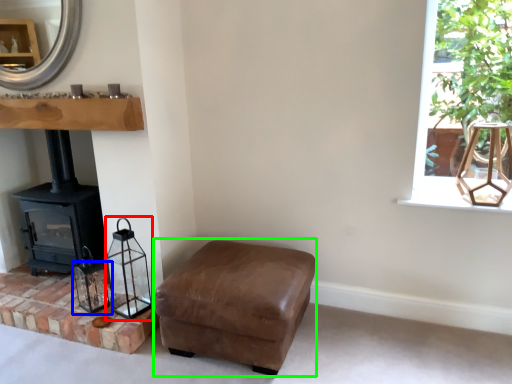
Question: Which object is positioned farthest from lamp (highlighted by a red box)? Select from candle holder (highlighted by a blue box) and armchair (highlighted by a green box).

Choices:
 (A) candle holder
 (B) armchair

Answer: (B)